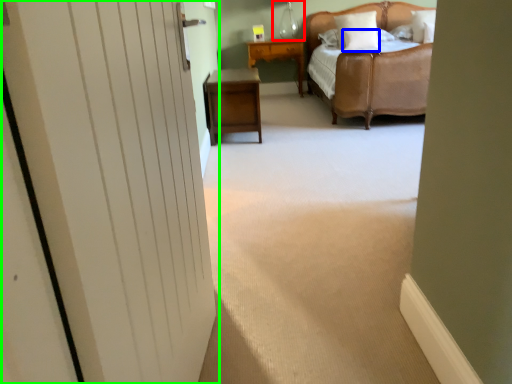
Question: Based on their relative distances, which object is farther from table lamp (highlighted by a red box)? Choose from pillow (highlighted by a blue box) and door (highlighted by a green box).

Choices:
 (A) pillow
 (B) door

Answer: (B)